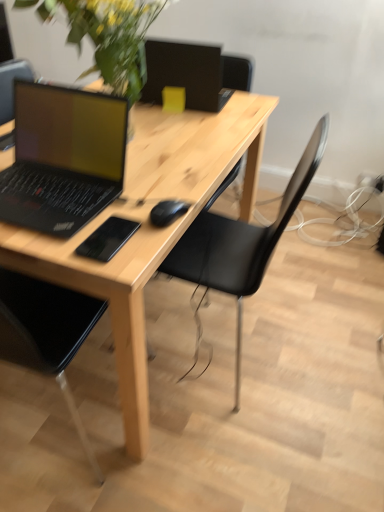
Question: Considering the relative positions of natural wood desk at center and matte black laptop at left in the image provided, is natural wood desk at center to the left or to the right of matte black laptop at left?

Choices:
 (A) left
 (B) right

Answer: (B)

Question: From a real-world perspective, is natural wood desk at center above or below matte black laptop at left?

Choices:
 (A) above
 (B) below

Answer: (B)

Question: Which is farther from the matte black laptop at left?

Choices:
 (A) natural wood desk at center
 (B) green leafy plant at upper left
 (C) black matte mouse at center
 (D) black matte mousepad at center
 (E) black plastic chair at center

Answer: (E)

Question: Which object is the farthest from the matte black laptop at left?

Choices:
 (A) natural wood desk at center
 (B) green leafy plant at upper left
 (C) black matte mouse at center
 (D) black matte mousepad at center
 (E) black plastic chair at center

Answer: (E)